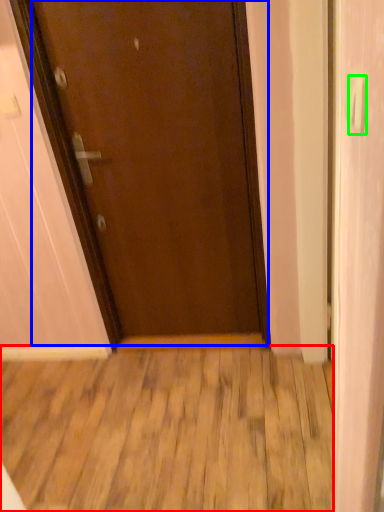
Question: Which is farther away from wood (highlighted by a red box)? door (highlighted by a blue box) or door handle (highlighted by a green box)?

Choices:
 (A) door
 (B) door handle

Answer: (B)